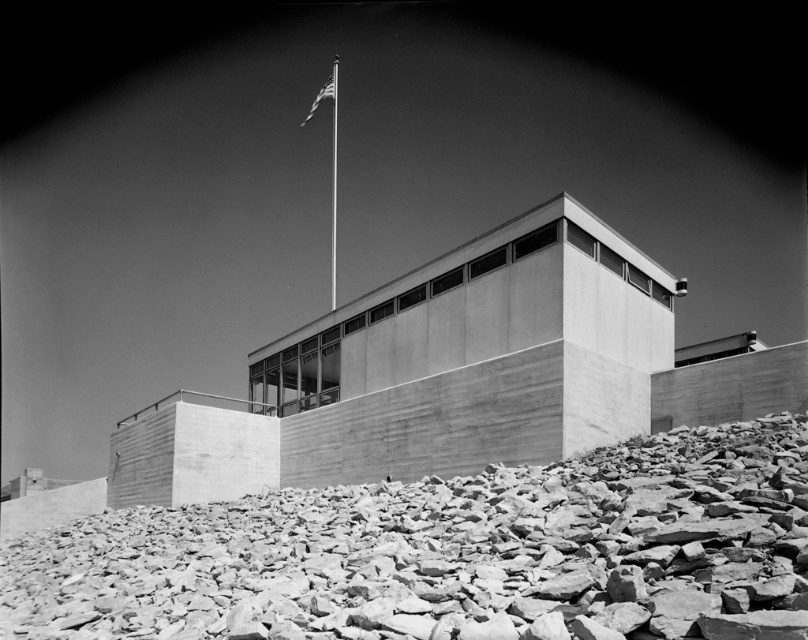
Question: Where is metallic flag pole at upper center located in relation to american flag at upper center in the image?

Choices:
 (A) left
 (B) right

Answer: (A)

Question: Based on their relative distances, which object is farther from the american flag at upper center?

Choices:
 (A) metallic flag pole at upper center
 (B) smooth gray rocks at bottom

Answer: (B)

Question: Which is nearer to the metallic flag pole at upper center?

Choices:
 (A) smooth gray rocks at bottom
 (B) american flag at upper center

Answer: (B)

Question: Is the position of smooth gray rocks at bottom less distant than that of metallic flag pole at upper center?

Choices:
 (A) yes
 (B) no

Answer: (A)

Question: Which point is closer to the camera?

Choices:
 (A) (335, 209)
 (B) (335, 84)
 (C) (415, 486)

Answer: (C)

Question: Can you confirm if smooth gray rocks at bottom is bigger than american flag at upper center?

Choices:
 (A) no
 (B) yes

Answer: (A)